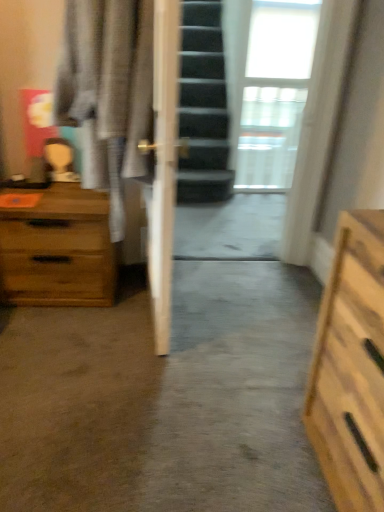
Question: In terms of size, does transparent glass door at center appear bigger or smaller than white sheer curtain at upper right?

Choices:
 (A) big
 (B) small

Answer: (B)

Question: From a real-world perspective, is transparent glass door at center above or below white sheer curtain at upper right?

Choices:
 (A) below
 (B) above

Answer: (B)

Question: Which object is positioned farthest from the wooden chest of drawers at left?

Choices:
 (A) white sheer curtain at upper right
 (B) transparent glass door at center
 (C) light gray fabric robe at left

Answer: (A)

Question: Based on their relative distances, which object is nearer to the white sheer curtain at upper right?

Choices:
 (A) wooden chest of drawers at left
 (B) transparent glass door at center
 (C) light gray fabric robe at left

Answer: (B)